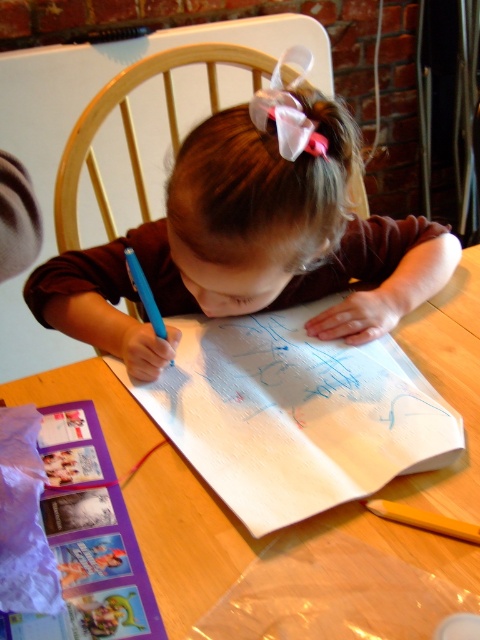
Question: Can you confirm if white textured paper at center is bigger than blue plastic pen at center?

Choices:
 (A) yes
 (B) no

Answer: (A)

Question: Does wooden crayon at lower right appear over blue plastic pen at center?

Choices:
 (A) yes
 (B) no

Answer: (B)

Question: Which point is farther to the camera?

Choices:
 (A) wooden crayon at lower right
 (B) blue plastic pen at center
 (C) white textured paper at center
 (D) brown matte shirt at center

Answer: (B)

Question: Does brown matte shirt at center have a larger size compared to wooden table at center?

Choices:
 (A) yes
 (B) no

Answer: (B)

Question: Which of these objects is positioned closest to the white textured paper at center?

Choices:
 (A) wooden crayon at lower right
 (B) blue plastic pen at center
 (C) brown matte shirt at center

Answer: (C)

Question: Which of these objects is positioned closest to the brown matte shirt at center?

Choices:
 (A) blue plastic pen at center
 (B) wooden crayon at lower right
 (C) wooden table at center
 (D) white textured paper at center

Answer: (D)